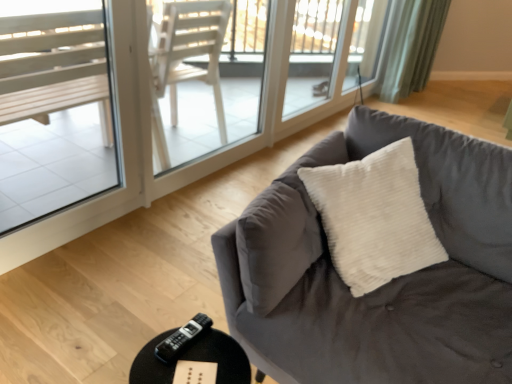
Question: In terms of height, does velvet gray couch at center look taller or shorter compared to clear glass window at left, which is counted as the first window, starting from the front?

Choices:
 (A) short
 (B) tall

Answer: (A)

Question: Is velvet gray couch at center situated inside clear glass window at left, which is the 2th window from top to bottom, or outside?

Choices:
 (A) outside
 (B) inside

Answer: (A)

Question: Which object is the closest to the white wood screen door at upper center, the first screen door viewed from the front?

Choices:
 (A) clear glass window at left, which is the first window from bottom to top
 (B) green fabric curtain at upper right
 (C) transparent glass screen door at upper center, placed as the 2th screen door when sorted from front to back
 (D) transparent glass window at upper center, placed as the 2th window when sorted from left to right
 (E) velvet gray couch at center

Answer: (C)

Question: Estimate the real-world distances between objects in this image. Which object is closer to the white wood screen door at upper center, marked as the 1th screen door in a left-to-right arrangement?

Choices:
 (A) green fabric curtain at upper right
 (B) transparent glass screen door at upper center, placed as the 2th screen door when sorted from front to back
 (C) black plastic remote at lower center
 (D) velvet gray couch at center
 (E) transparent glass window at upper center, placed as the 2th window when sorted from left to right

Answer: (B)